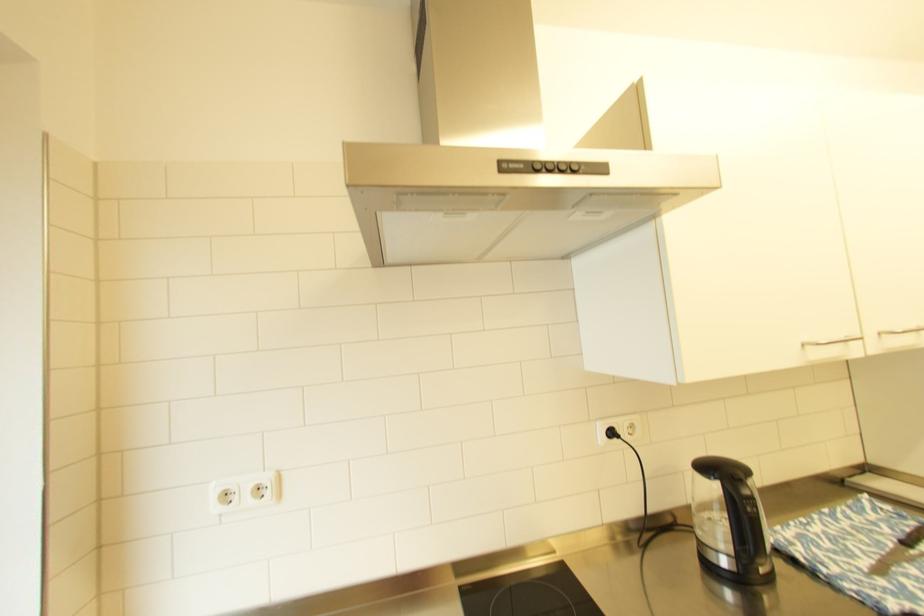
This screenshot has width=924, height=616. Find the location of `black extractor button`. black extractor button is located at coordinates (728, 521).